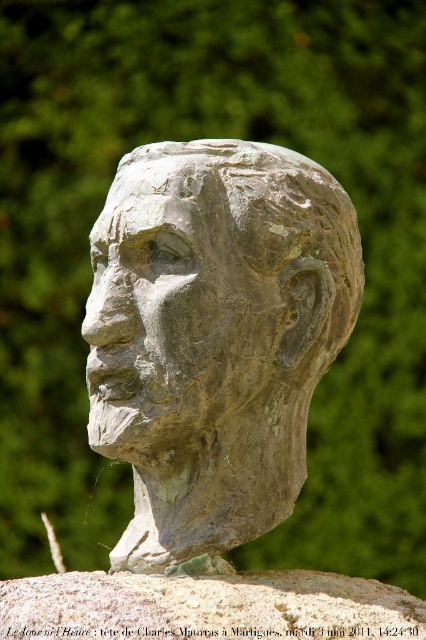
Does gray stone head at center have a greater height compared to gray stone bust at center?

Indeed, gray stone head at center has a greater height compared to gray stone bust at center.

Does point (124, 458) come in front of point (141, 586)?

No.

This screenshot has height=640, width=426. In order to click on gray stone head at center in this screenshot , I will do `click(215, 298)`.